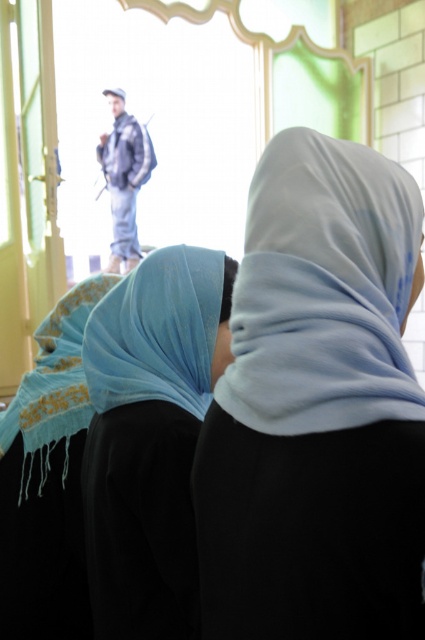
Question: Is light blue fabric scarf at upper center below light blue sheer hijab at center?

Choices:
 (A) no
 (B) yes

Answer: (A)

Question: Is light blue sheer hijab at center to the left of blue fabric headscarf at center from the viewer's perspective?

Choices:
 (A) yes
 (B) no

Answer: (A)

Question: Considering the real-world distances, which object is closest to the light blue fabric scarf at upper center?

Choices:
 (A) blue fabric headscarf at center
 (B) turquoise woven shawl at lower left
 (C) light blue sheer hijab at center

Answer: (C)

Question: Considering the relative positions of blue fabric headscarf at center and turquoise woven shawl at lower left in the image provided, where is blue fabric headscarf at center located with respect to turquoise woven shawl at lower left?

Choices:
 (A) below
 (B) above

Answer: (B)

Question: Which object is closer to the camera taking this photo?

Choices:
 (A) blue fabric headscarf at center
 (B) light blue fabric scarf at upper center
 (C) light blue sheer hijab at center

Answer: (B)

Question: Among these points, which one is farthest from the camera?

Choices:
 (A) (243, 412)
 (B) (209, 381)
 (C) (167, 248)
 (D) (44, 332)

Answer: (D)